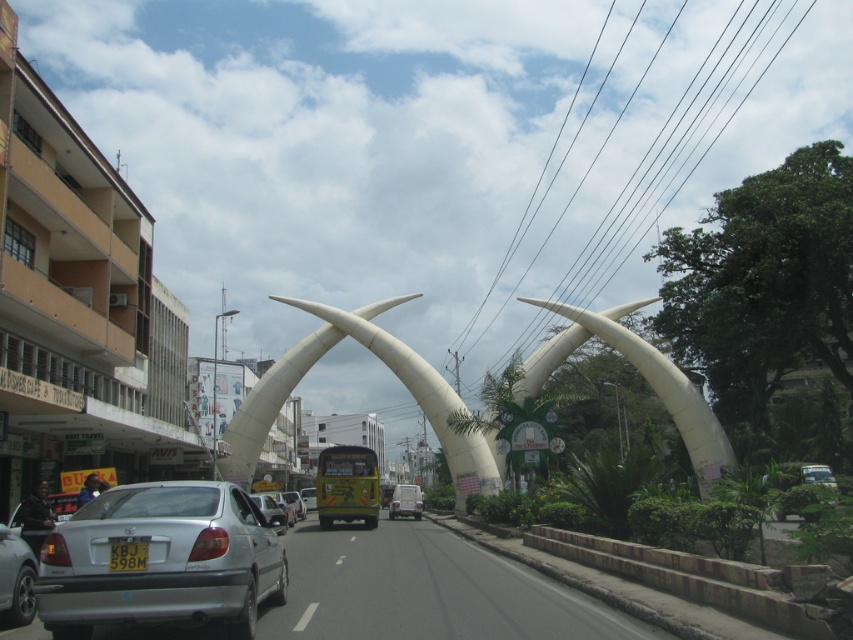
Is point (6, 532) positioned after point (140, 564)?

Yes, it is.

Is point (13, 548) less distant than point (144, 544)?

No, it is not.

Where is `silver metallic car at lower left`? silver metallic car at lower left is located at coordinates (15, 579).

Does silver metallic car at center have a greater height compared to silver metallic car at lower left?

Incorrect, silver metallic car at center's height is not larger of silver metallic car at lower left's.

Is silver metallic car at center behind silver metallic car at lower left?

Yes, silver metallic car at center is behind silver metallic car at lower left.

Identify the location of silver metallic car at center. The image size is (853, 640). (161, 560).

From the picture: Measure the distance between silver metallic car at lower left and metallic silver van at center.

A distance of 31.21 meters exists between silver metallic car at lower left and metallic silver van at center.

At what (x,y) coordinates should I click in order to perform the action: click on silver metallic car at lower left. Please return your answer as a coordinate pair (x, y). Looking at the image, I should click on (15, 579).